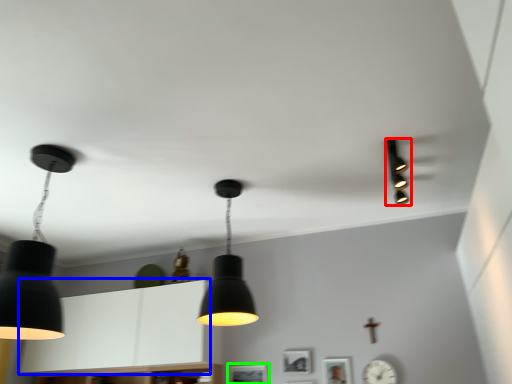
Question: Which object is the closest to the lamp (highlighted by a red box)? Choose among these: cabinetry (highlighted by a blue box) or picture frame (highlighted by a green box).

Choices:
 (A) cabinetry
 (B) picture frame

Answer: (B)